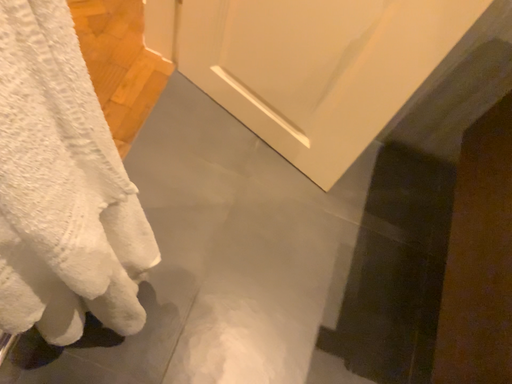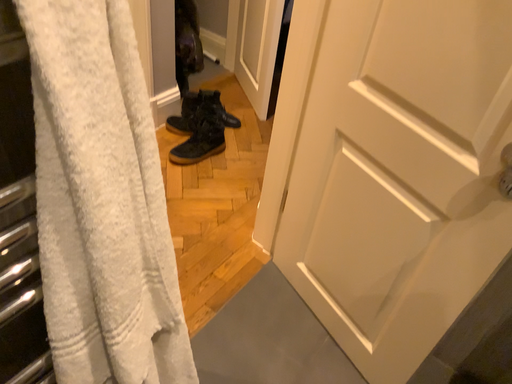
Question: Which way did the camera rotate in the video?

Choices:
 (A) rotated upward
 (B) rotated downward

Answer: (A)